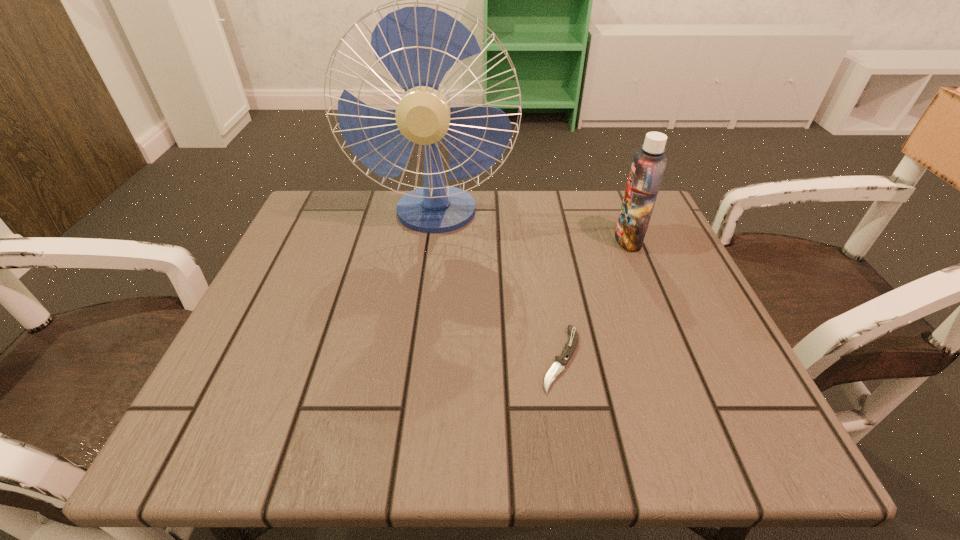
The image size is (960, 540). Find the location of `vacant space located 0.130m on the left of the nearest object`. vacant space located 0.130m on the left of the nearest object is located at coordinates [x=463, y=359].

Identify the location of fan at the far edge. (417, 45).

You are a GUI agent. You are given a task and a screenshot of the screen. Output one action in this format:
    pyautogui.click(x=<x>, y=<y>)
    Task: Click on the shampoo that is positioned at the far edge
    This screenshot has height=540, width=960.
    Given the screenshot: What is the action you would take?
    pyautogui.click(x=648, y=166)

Locate an element on the screen. The width and height of the screenshot is (960, 540). object that is at the left edge is located at coordinates (417, 45).

At what (x,y) coordinates should I click in order to perform the action: click on object that is at the right edge. Please return your answer as a coordinate pair (x, y). This screenshot has width=960, height=540. Looking at the image, I should click on (648, 166).

What are the coordinates of `object present at the far left corner` in the screenshot? It's located at [x=417, y=45].

Locate an element on the screen. The width and height of the screenshot is (960, 540). object that is at the far right corner is located at coordinates point(648,166).

Where is `free point at the far edge`? This screenshot has width=960, height=540. free point at the far edge is located at coordinates (552, 224).

Where is `vacant region at the near edge of the desktop`? This screenshot has width=960, height=540. vacant region at the near edge of the desktop is located at coordinates (424, 449).

In the image, there is a desktop. Find the location of `blank space at the left edge`. blank space at the left edge is located at coordinates (317, 295).